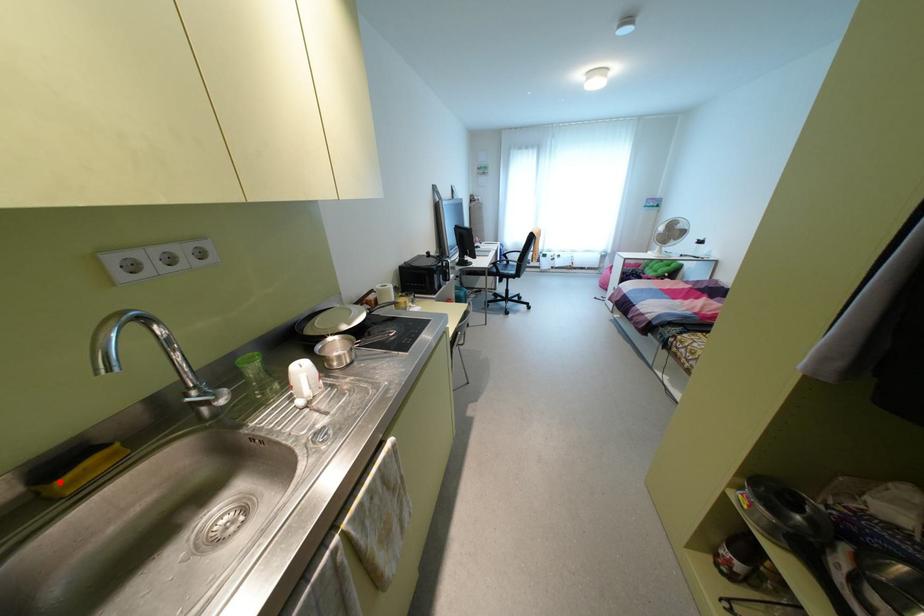
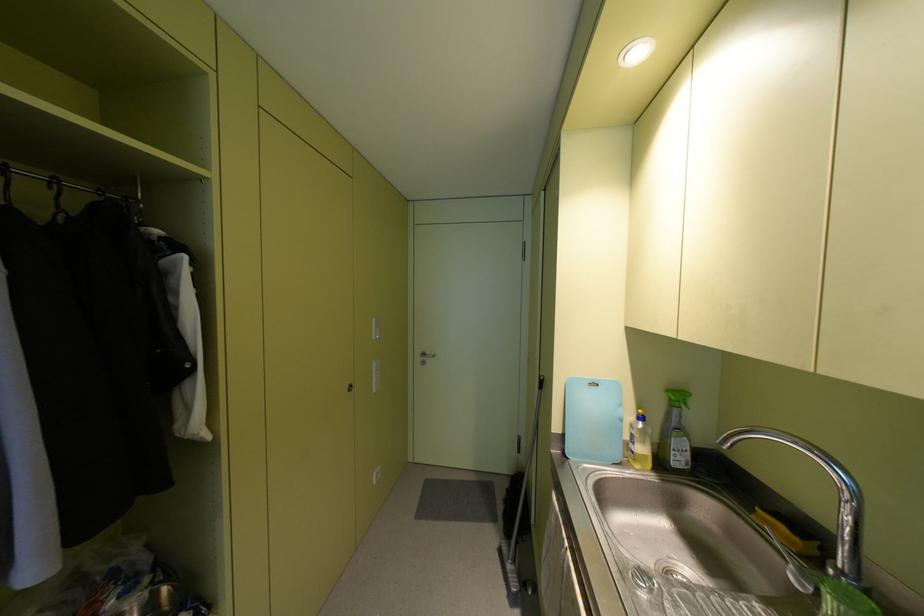
Find the pixel in the second image that matches the highlighted location in the first image.

(759, 511)